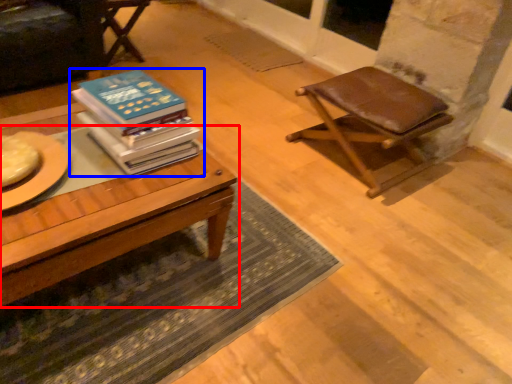
Question: Which point is further to the camera, table (highlighted by a red box) or book (highlighted by a blue box)?

Choices:
 (A) table
 (B) book

Answer: (B)